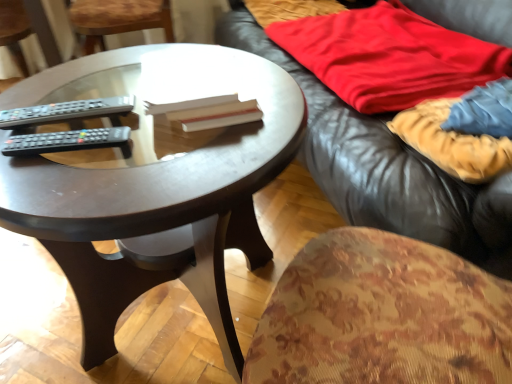
Question: Considering the positions of black plastic remote at center, the 2th remote control in the front-to-back sequence, and red cotton blanket at upper right, arranged as the first blanket when viewed from the back, in the image, is black plastic remote at center, the 2th remote control in the front-to-back sequence, wider or thinner than red cotton blanket at upper right, arranged as the first blanket when viewed from the back,?

Choices:
 (A) thin
 (B) wide

Answer: (A)

Question: Considering their positions, is black plastic remote at center, the 2th remote control in the front-to-back sequence, located in front of or behind red cotton blanket at upper right, arranged as the first blanket when viewed from the back?

Choices:
 (A) behind
 (B) front

Answer: (B)

Question: Based on their relative distances, which object is farther from the wooden at left?

Choices:
 (A) velvet-like beige blanket at right, positioned as the first blanket in front-to-back order
 (B) red cotton blanket at upper right, acting as the 2th blanket starting from the front
 (C) black plastic remote at center, marked as the 1th remote control in a back-to-front arrangement
 (D) dark wood coffee table at center
 (E) black plastic remote control at left, positioned as the 2th remote control in back-to-front order

Answer: (A)

Question: Estimate the real-world distances between objects in this image. Which object is farther from the leather couch at upper right?

Choices:
 (A) velvet-like beige blanket at right, placed as the 2th blanket when sorted from back to front
 (B) dark wood coffee table at center
 (C) black plastic remote at center, marked as the 1th remote control in a back-to-front arrangement
 (D) black plastic remote control at left, which is the 1th remote control in front-to-back order
 (E) red cotton blanket at upper right, acting as the 2th blanket starting from the front

Answer: (D)